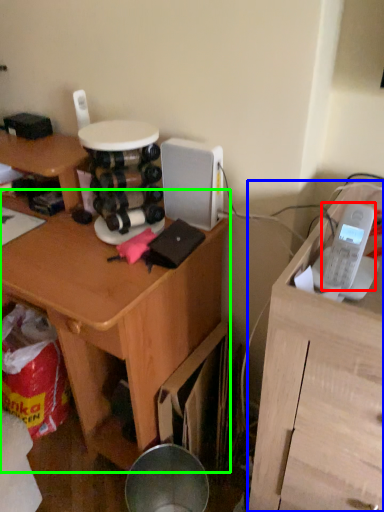
Question: Which is nearer to the ipod (highlighted by a red box)? furniture (highlighted by a blue box) or desk (highlighted by a green box).

Choices:
 (A) furniture
 (B) desk

Answer: (A)